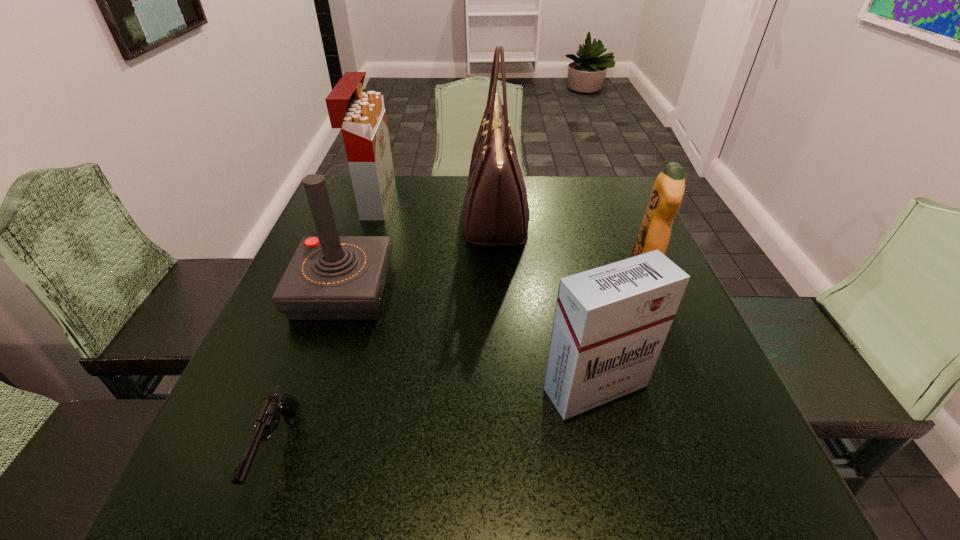
The image size is (960, 540). In order to click on cigarette case located in the left edge section of the desktop in this screenshot , I will do point(361,116).

What are the coordinates of `joystick located at the left edge` in the screenshot? It's located at (330, 277).

At what (x,y) coordinates should I click in order to perform the action: click on gun that is at the left edge. Please return your answer as a coordinate pair (x, y). Looking at the image, I should click on (268, 418).

The image size is (960, 540). I want to click on detergent at the right edge, so click(668, 190).

You are a GUI agent. You are given a task and a screenshot of the screen. Output one action in this format:
    pyautogui.click(x=<x>, y=<y>)
    Task: Click on the cigarette case that is at the right edge
    
    Given the screenshot: What is the action you would take?
    pyautogui.click(x=610, y=323)

This screenshot has height=540, width=960. In order to click on object positioned at the far left corner in this screenshot , I will do `click(361, 116)`.

Where is `object at the near left corner`? This screenshot has height=540, width=960. object at the near left corner is located at coordinates (268, 418).

This screenshot has width=960, height=540. I want to click on free region at the far edge of the desktop, so click(x=459, y=218).

In the image, there is a desktop. At what (x,y) coordinates should I click in order to perform the action: click on vacant space at the near edge. Please return your answer as a coordinate pair (x, y). This screenshot has width=960, height=540. Looking at the image, I should click on (407, 468).

Identify the location of vacant space at the left edge of the desktop. The width and height of the screenshot is (960, 540). click(297, 370).